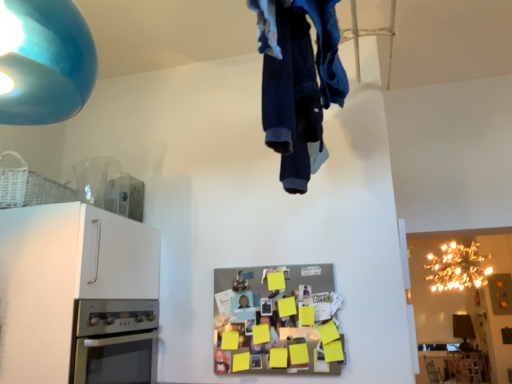
The image size is (512, 384). What do you see at coordinates (276, 320) in the screenshot? I see `metallic silver refrigerator at center` at bounding box center [276, 320].

How much space does gold metallic chandelier at upper right, the second lamp when ordered from left to right, occupy horizontally?

gold metallic chandelier at upper right, the second lamp when ordered from left to right, is 23.37 inches wide.

Locate an element on the screen. stainless steel oven at lower left is located at coordinates (114, 341).

Find the location of `white matte cabinet at left`. white matte cabinet at left is located at coordinates (77, 296).

Identify the location of metallic silver refrigerator at center. (276, 320).

Measure the distance between metallic silver refrigerator at center and white matte cabinet at left.

metallic silver refrigerator at center and white matte cabinet at left are 22.30 inches apart from each other.

Which object is positioned more to the right, metallic silver refrigerator at center or white matte cabinet at left?

metallic silver refrigerator at center.

Are metallic silver refrigerator at center and white matte cabinet at left far apart?

That's not correct — metallic silver refrigerator at center is a little close to white matte cabinet at left.

Is point (229, 365) positioned behind point (53, 228)?

That is True.

Is white matte cabinet at left far away from gold metallic chandelier at upper right, which ranks as the 1th lamp in back-to-front order?

Yes, white matte cabinet at left and gold metallic chandelier at upper right, which ranks as the 1th lamp in back-to-front order, are located far from each other.

The height and width of the screenshot is (384, 512). Identify the location of cabinetry on the left of gold metallic chandelier at upper right, the 2th lamp viewed from the top. (77, 296).

Which object is closer to the camera taking this photo, white matte cabinet at left or gold metallic chandelier at upper right, the 1th lamp in the bottom-to-top sequence?

white matte cabinet at left is closer to the camera.

Is white matte cabinet at left thinner than gold metallic chandelier at upper right, the 1th lamp in the bottom-to-top sequence?

In fact, white matte cabinet at left might be wider than gold metallic chandelier at upper right, the 1th lamp in the bottom-to-top sequence.

Is matte blue lampshade at upper left, which is counted as the first lamp, starting from the front, facing away from stainless steel oven at lower left?

No, stainless steel oven at lower left is not at the back of matte blue lampshade at upper left, which is counted as the first lamp, starting from the front.

From a real-world perspective, is matte blue lampshade at upper left, the second lamp from the bottom, located beneath stainless steel oven at lower left?

Incorrect, from a real-world perspective, matte blue lampshade at upper left, the second lamp from the bottom, is higher than stainless steel oven at lower left.

Is matte blue lampshade at upper left, the second lamp in the back-to-front sequence, positioned far away from stainless steel oven at lower left?

They are positioned close to each other.

Which object is thinner, denim fabric pants at upper center or white matte cabinet at left?

denim fabric pants at upper center is thinner.

Which is more to the left, denim fabric pants at upper center or white matte cabinet at left?

From the viewer's perspective, white matte cabinet at left appears more on the left side.

Looking at this image, is there a large distance between denim fabric pants at upper center and white matte cabinet at left?

That's not correct — denim fabric pants at upper center is a little close to white matte cabinet at left.

From a real-world perspective, does denim fabric pants at upper center sit lower than white matte cabinet at left?

No.

Would you say gold metallic chandelier at upper right, marked as the 2th lamp in a front-to-back arrangement, is part of denim fabric pants at upper center's contents?

No, gold metallic chandelier at upper right, marked as the 2th lamp in a front-to-back arrangement, is not inside denim fabric pants at upper center.

Is denim fabric pants at upper center oriented towards gold metallic chandelier at upper right, the 1th lamp in the bottom-to-top sequence?

No, denim fabric pants at upper center is not turned towards gold metallic chandelier at upper right, the 1th lamp in the bottom-to-top sequence.

Is stainless steel oven at lower left positioned beyond the bounds of white matte cabinet at left?

That's incorrect, stainless steel oven at lower left is not completely outside white matte cabinet at left.

How many degrees apart are the facing directions of stainless steel oven at lower left and white matte cabinet at left?

1.99 degrees separate the facing orientations of stainless steel oven at lower left and white matte cabinet at left.

Does stainless steel oven at lower left have a lesser width compared to white matte cabinet at left?

In fact, stainless steel oven at lower left might be wider than white matte cabinet at left.

Who is shorter, stainless steel oven at lower left or gold metallic chandelier at upper right, marked as the 2th lamp in a front-to-back arrangement?

stainless steel oven at lower left is shorter.

Could gold metallic chandelier at upper right, the 2th lamp viewed from the top, be considered to be inside stainless steel oven at lower left?

No, stainless steel oven at lower left does not contain gold metallic chandelier at upper right, the 2th lamp viewed from the top.

Which is in front, point (123, 340) or point (445, 248)?

The point (123, 340) is more forward.

Is stainless steel oven at lower left at the left side of gold metallic chandelier at upper right, which ranks as the 1th lamp in back-to-front order?

Yes.

At what (x,y) coordinates should I click in order to perform the action: click on cabinetry lying on the left of metallic silver refrigerator at center. Please return your answer as a coordinate pair (x, y). Looking at the image, I should click on (77, 296).

At what (x,y) coordinates should I click in order to perform the action: click on lamp that is the 1st object above the white matte cabinet at left (from a real-world perspective). Please return your answer as a coordinate pair (x, y). This screenshot has height=384, width=512. Looking at the image, I should click on point(457,267).

When comparing their distances from metallic silver refrigerator at center, does denim fabric pants at upper center or gold metallic chandelier at upper right, the second lamp when ordered from left to right, seem closer?

denim fabric pants at upper center.

When comparing their distances from metallic silver refrigerator at center, does white matte cabinet at left or matte blue lampshade at upper left, the first lamp viewed from the left, seem closer?

Based on the image, white matte cabinet at left appears to be nearer to metallic silver refrigerator at center.

When comparing their distances from stainless steel oven at lower left, does denim fabric pants at upper center or metallic silver refrigerator at center seem further?

denim fabric pants at upper center is positioned further to the anchor stainless steel oven at lower left.

When comparing their distances from matte blue lampshade at upper left, the first lamp in the top-to-bottom sequence, does stainless steel oven at lower left or metallic silver refrigerator at center seem further?

metallic silver refrigerator at center is further to matte blue lampshade at upper left, the first lamp in the top-to-bottom sequence.

From the image, which object appears to be farther from denim fabric pants at upper center, white matte cabinet at left or gold metallic chandelier at upper right, which ranks as the 1th lamp in back-to-front order?

Among the two, gold metallic chandelier at upper right, which ranks as the 1th lamp in back-to-front order, is located further to denim fabric pants at upper center.

Which object lies nearer to the anchor point white matte cabinet at left, stainless steel oven at lower left or gold metallic chandelier at upper right, positioned as the 1th lamp in right-to-left order?

Among the two, stainless steel oven at lower left is located nearer to white matte cabinet at left.

When comparing their distances from metallic silver refrigerator at center, does gold metallic chandelier at upper right, the second lamp when ordered from left to right, or white matte cabinet at left seem further?

gold metallic chandelier at upper right, the second lamp when ordered from left to right, is further to metallic silver refrigerator at center.

Estimate the real-world distances between objects in this image. Which object is further from matte blue lampshade at upper left, the first lamp in the top-to-bottom sequence, white matte cabinet at left or metallic silver refrigerator at center?

metallic silver refrigerator at center.

You are a GUI agent. You are given a task and a screenshot of the screen. Output one action in this format:
    pyautogui.click(x=<x>, y=<y>)
    Task: Click on the appliance located between denim fabric pants at upper center and gold metallic chandelier at upper right, positioned as the 1th lamp in right-to-left order, in the depth direction
    The image size is (512, 384).
    Given the screenshot: What is the action you would take?
    pyautogui.click(x=276, y=320)

Identify the location of cabinetry between matte blue lampshade at upper left, the first lamp viewed from the left, and metallic silver refrigerator at center vertically. This screenshot has width=512, height=384. (77, 296).

Find the location of `appliance between white matte cabinet at left and gold metallic chandelier at upper right, the second lamp when ordered from left to right, from left to right`. appliance between white matte cabinet at left and gold metallic chandelier at upper right, the second lamp when ordered from left to right, from left to right is located at coordinates (276, 320).

The width and height of the screenshot is (512, 384). In order to click on home appliance positioned between denim fabric pants at upper center and gold metallic chandelier at upper right, the second lamp when ordered from left to right, from near to far in this screenshot , I will do `click(114, 341)`.